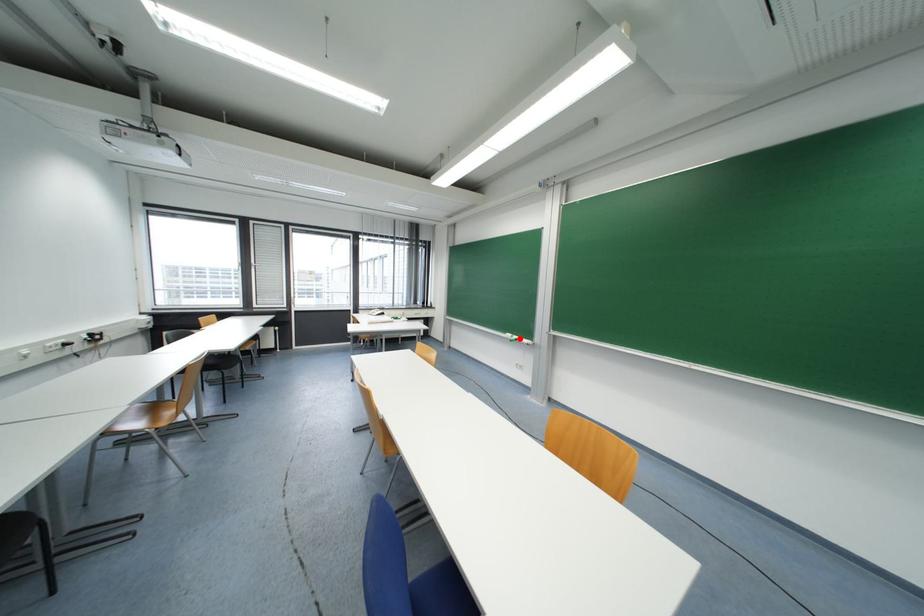
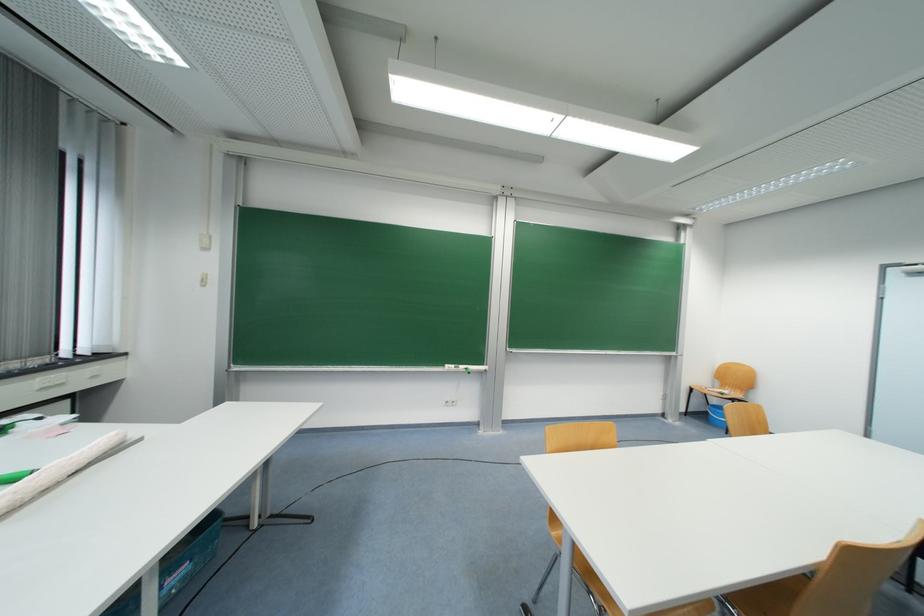
Where in the second image is the point corresponding to the highlighted location from the first image?

(467, 369)